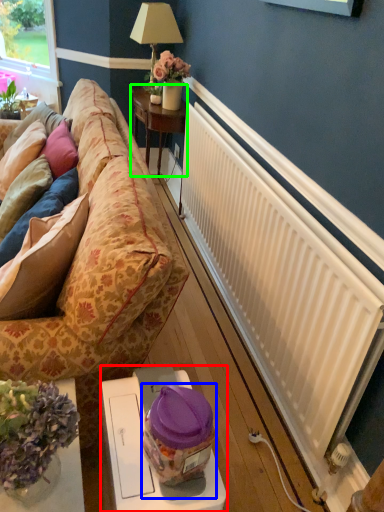
Question: Estimate the real-world distances between objects in this image. Which object is farther from table (highlighted by a red box), food (highlighted by a blue box) or table (highlighted by a green box)?

Choices:
 (A) food
 (B) table

Answer: (B)